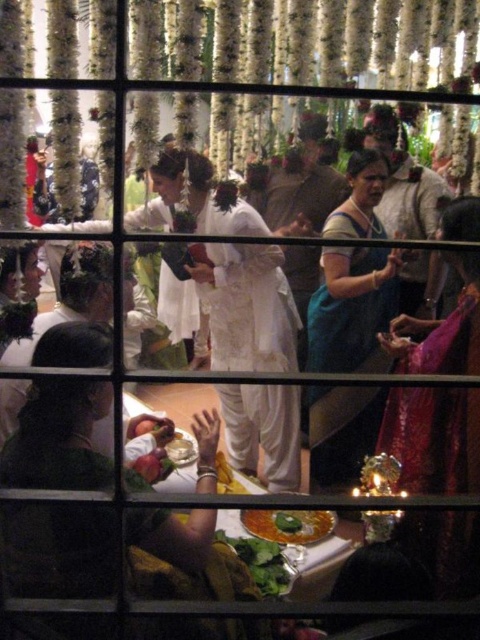
You are a guest at the wedding and want to compliment the bride on her outfit. Which item is bigger, the silky pink saree at right or the shiny golden plate at lower center?

The silky pink saree at right is larger in size than the shiny golden plate at lower center, so the silky pink saree at right is bigger.

You are attending a traditional Indian wedding and notice two important items in the scene. One is the bride wearing a white saree in the center, and the other is the silky pink saree at right. Based on their positions, which item is closer to the bottom edge of the image?

The silky pink saree at right is closer to the bottom edge of the image because its position at point 0.902 on the y axis indicates it is lower than the bride in the center.

You are attending a traditional Indian wedding and notice two items in the scene. One is the silky pink saree at right and the other is the white glossy bowl at center. Which item is positioned higher in the image?

The silky pink saree at right is located above the white glossy bowl at center, so it is positioned higher in the image.